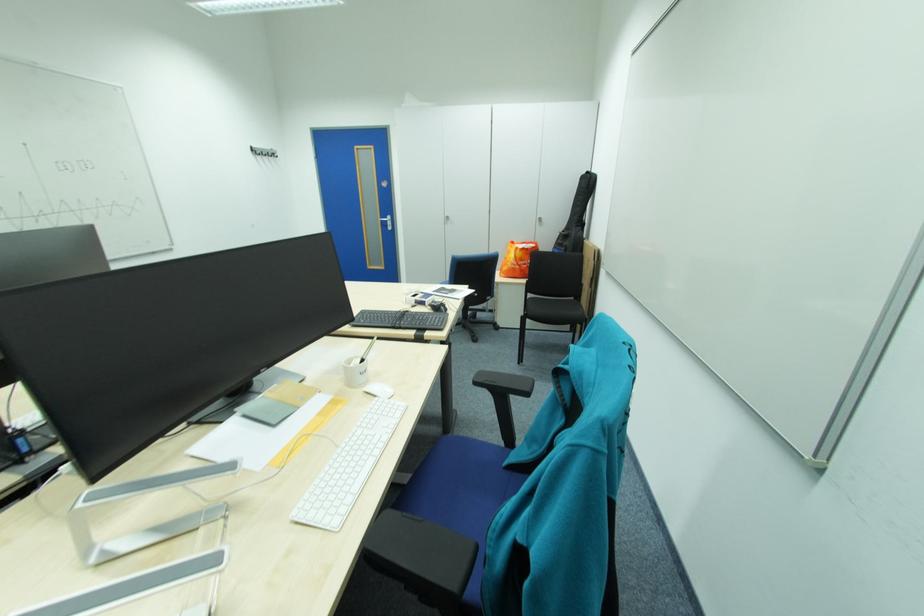
The image size is (924, 616). Describe the element at coordinates (459, 484) in the screenshot. I see `the blue chair sitting surface` at that location.